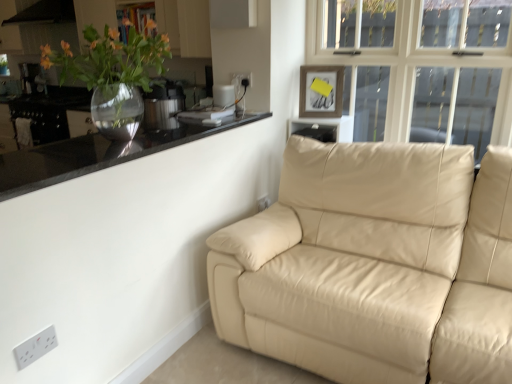
How much space does white plastic electric outlet at upper center, acting as the 2th electric outlet starting from the back, occupy vertically?

2.87 inches.

Image resolution: width=512 pixels, height=384 pixels. What do you see at coordinates (242, 79) in the screenshot?
I see `white plastic electric outlet at upper center, the second electric outlet from the right` at bounding box center [242, 79].

You are a GUI agent. You are given a task and a screenshot of the screen. Output one action in this format:
    pyautogui.click(x=<x>, y=<y>)
    Task: Click on the brushed metal kettle at left, positioned as the first appliance in back-to-front order
    This screenshot has width=512, height=384.
    Given the screenshot: What is the action you would take?
    pyautogui.click(x=32, y=78)

Identify the location of black matte exhaust hood at upper left. The image size is (512, 384). (45, 13).

What is the approximate height of white plastic electric outlet at lower center, marked as the 3th electric outlet in a left-to-right arrangement?

It is 3.95 inches.

What do you see at coordinates (375, 265) in the screenshot? I see `beige leather couch at right` at bounding box center [375, 265].

Where is `white plastic electric outlet at lower left, arranged as the 3th electric outlet when viewed from the right`? The height and width of the screenshot is (384, 512). white plastic electric outlet at lower left, arranged as the 3th electric outlet when viewed from the right is located at coordinates (35, 347).

This screenshot has height=384, width=512. What are the coordinates of `clear glass vase at upper left` in the screenshot? It's located at (112, 75).

Is satin silver pressure cooker at upper left, which is counted as the 1th appliance, starting from the front, far away from white matte window sill at upper center?

That's not correct — satin silver pressure cooker at upper left, which is counted as the 1th appliance, starting from the front, is a little close to white matte window sill at upper center.

Is satin silver pressure cooker at upper left, which is counted as the second appliance, starting from the top, inside or outside of white matte window sill at upper center?

satin silver pressure cooker at upper left, which is counted as the second appliance, starting from the top, cannot be found inside white matte window sill at upper center.

Locate an element on the screen. appliance that is in front of the white matte window sill at upper center is located at coordinates (163, 106).

Does satin silver pressure cooker at upper left, which is the first appliance in bottom-to-top order, lie behind white matte window sill at upper center?

No.

From the image's perspective, does white matte window sill at upper center appear higher than black matte exhaust hood at upper left?

No, from the image's perspective, white matte window sill at upper center is not over black matte exhaust hood at upper left.

Is black matte exhaust hood at upper left at the back of white matte window sill at upper center?

No, black matte exhaust hood at upper left is not at the back of white matte window sill at upper center.

Identify the location of exhaust hood behind the white matte window sill at upper center. (45, 13).

From the picture: Which point is more distant from viewer, [349,131] or [20,15]?

The point [20,15] is behind.

Can you tell me how much white plastic electric outlet at lower center, marked as the 2th electric outlet in a bottom-to-top arrangement, and white matte window sill at upper center differ in facing direction?

90.8 degrees separate the facing orientations of white plastic electric outlet at lower center, marked as the 2th electric outlet in a bottom-to-top arrangement, and white matte window sill at upper center.

Is white plastic electric outlet at lower center, the 2th electric outlet viewed from the top, inside the boundaries of white matte window sill at upper center, or outside?

white plastic electric outlet at lower center, the 2th electric outlet viewed from the top, cannot be found inside white matte window sill at upper center.

Is white plastic electric outlet at lower center, which is the first electric outlet in right-to-left order, bigger than white matte window sill at upper center?

No, white plastic electric outlet at lower center, which is the first electric outlet in right-to-left order, is not bigger than white matte window sill at upper center.

Is white plastic electric outlet at lower center, which appears as the 3th electric outlet when viewed from the front, aimed at white matte window sill at upper center?

No, white plastic electric outlet at lower center, which appears as the 3th electric outlet when viewed from the front, is not turned towards white matte window sill at upper center.

You are a GUI agent. You are given a task and a screenshot of the screen. Output one action in this format:
    pyautogui.click(x=<x>, y=<y>)
    Task: Click on the 1st appliance above when counting from the clear glass vase at upper left (from the image's perspective)
    
    Given the screenshot: What is the action you would take?
    pyautogui.click(x=163, y=106)

Can you confirm if clear glass vase at upper left is positioned to the right of satin silver pressure cooker at upper left, which is the second appliance in left-to-right order?

Yes, clear glass vase at upper left is to the right of satin silver pressure cooker at upper left, which is the second appliance in left-to-right order.

Can you confirm if clear glass vase at upper left is shorter than satin silver pressure cooker at upper left, which is counted as the 1th appliance, starting from the front?

In fact, clear glass vase at upper left may be taller than satin silver pressure cooker at upper left, which is counted as the 1th appliance, starting from the front.

From a real-world perspective, is beige leather couch at right above or below brushed metal kettle at left, positioned as the 1th appliance in top-to-bottom order?

beige leather couch at right is situated lower than brushed metal kettle at left, positioned as the 1th appliance in top-to-bottom order, in the real world.

Does beige leather couch at right touch brushed metal kettle at left, marked as the 1th appliance in a left-to-right arrangement?

No.

Is beige leather couch at right bigger than brushed metal kettle at left, positioned as the 1th appliance in top-to-bottom order?

Correct, beige leather couch at right is larger in size than brushed metal kettle at left, positioned as the 1th appliance in top-to-bottom order.

Which object is wider, beige leather couch at right or brushed metal kettle at left, which is the second appliance from bottom to top?

Wider between the two is beige leather couch at right.

Is white plastic electric outlet at lower left, which is the first electric outlet from bottom to top, not within black matte exhaust hood at upper left?

Yes, white plastic electric outlet at lower left, which is the first electric outlet from bottom to top, is located beyond the bounds of black matte exhaust hood at upper left.

Which of these two, white plastic electric outlet at lower left, which is the 3th electric outlet from top to bottom, or black matte exhaust hood at upper left, is thinner?

white plastic electric outlet at lower left, which is the 3th electric outlet from top to bottom.

Measure the distance from white plastic electric outlet at lower left, the 1th electric outlet in the front-to-back sequence, to black matte exhaust hood at upper left.

The distance of white plastic electric outlet at lower left, the 1th electric outlet in the front-to-back sequence, from black matte exhaust hood at upper left is 3.52 meters.

Considering the positions of objects white matte window sill at upper center and beige leather couch at right in the image provided, who is more to the right, white matte window sill at upper center or beige leather couch at right?

beige leather couch at right.

Does white matte window sill at upper center have a lesser width compared to beige leather couch at right?

Correct, the width of white matte window sill at upper center is less than that of beige leather couch at right.

Find the location of a particular element. Image resolution: width=512 pixels, height=384 pixels. window sill that is on the left side of beige leather couch at right is located at coordinates (326, 126).

At what (x,y) coordinates should I click in order to perform the action: click on window sill lying behind the satin silver pressure cooker at upper left, which is the second appliance in left-to-right order. Please return your answer as a coordinate pair (x, y). Looking at the image, I should click on (326, 126).

Where is `exhaust hood positioned vertically above the white matte window sill at upper center (from a real-world perspective)`? This screenshot has height=384, width=512. exhaust hood positioned vertically above the white matte window sill at upper center (from a real-world perspective) is located at coordinates (45, 13).

Estimate the real-world distances between objects in this image. Which object is further from white plastic electric outlet at lower left, which is the 3th electric outlet from top to bottom, white plastic electric outlet at upper center, acting as the 2th electric outlet starting from the back, or wooden picture frame at upper center?

The object further to white plastic electric outlet at lower left, which is the 3th electric outlet from top to bottom, is wooden picture frame at upper center.

Considering their positions, is satin silver pressure cooker at upper left, the second appliance viewed from the back, positioned further to white plastic electric outlet at upper center, acting as the 2th electric outlet starting from the back, than black matte exhaust hood at upper left?

The object further to white plastic electric outlet at upper center, acting as the 2th electric outlet starting from the back, is black matte exhaust hood at upper left.

Looking at the image, which one is located further to white plastic electric outlet at lower center, the 2th electric outlet viewed from the top, clear glass vase at upper left or white plastic electric outlet at upper center, the second electric outlet from the left?

clear glass vase at upper left.

Which object lies nearer to the anchor point clear glass vase at upper left, satin silver pressure cooker at upper left, the second appliance viewed from the back, or brushed metal kettle at left, the 2th appliance when ordered from right to left?

satin silver pressure cooker at upper left, the second appliance viewed from the back, is positioned closer to the anchor clear glass vase at upper left.

Looking at the image, which one is located closer to white matte window sill at upper center, satin silver pressure cooker at upper left, which is counted as the 1th appliance, starting from the front, or brushed metal kettle at left, the 2th appliance when ordered from right to left?

satin silver pressure cooker at upper left, which is counted as the 1th appliance, starting from the front.

From the image, which object appears to be nearer to satin silver pressure cooker at upper left, which is the 1th appliance in right-to-left order, white plastic electric outlet at lower left, which is the 3th electric outlet from top to bottom, or white matte window sill at upper center?

The object closer to satin silver pressure cooker at upper left, which is the 1th appliance in right-to-left order, is white matte window sill at upper center.

Considering their positions, is white plastic electric outlet at lower left, marked as the 1th electric outlet in a left-to-right arrangement, positioned closer to white matte window sill at upper center than wooden picture frame at upper center?

wooden picture frame at upper center lies closer to white matte window sill at upper center than the other object.

Based on their spatial positions, is white plastic electric outlet at lower left, which is the first electric outlet from bottom to top, or wooden picture frame at upper center closer to clear glass vase at upper left?

white plastic electric outlet at lower left, which is the first electric outlet from bottom to top, is closer to clear glass vase at upper left.

Locate an element on the screen. window sill between white plastic electric outlet at upper center, the second electric outlet from the right, and white plastic electric outlet at lower center, the 1th electric outlet in the back-to-front sequence, vertically is located at coordinates (326, 126).

This screenshot has width=512, height=384. Identify the location of countertop between beige leather couch at right and black matte exhaust hood at upper left from front to back. (95, 155).

Where is `houseplant between white plastic electric outlet at lower left, which is the 3th electric outlet from top to bottom, and black matte exhaust hood at upper left in the front-back direction`? The width and height of the screenshot is (512, 384). houseplant between white plastic electric outlet at lower left, which is the 3th electric outlet from top to bottom, and black matte exhaust hood at upper left in the front-back direction is located at coordinates (112, 75).

Locate an element on the screen. This screenshot has width=512, height=384. appliance between black matte exhaust hood at upper left and wooden picture frame at upper center is located at coordinates (163, 106).